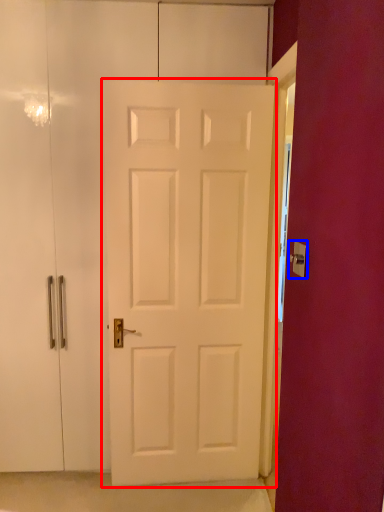
Question: Which of the following is the closest to the observer, door (highlighted by a red box) or door handle (highlighted by a blue box)?

Choices:
 (A) door
 (B) door handle

Answer: (B)